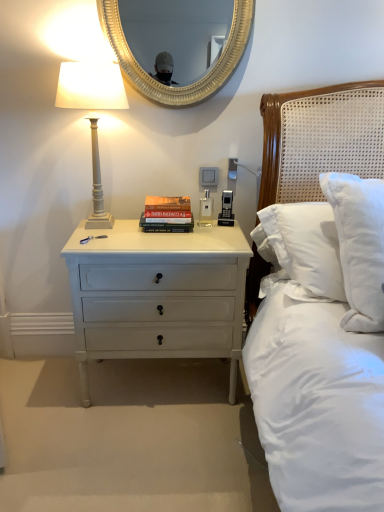
Question: Are gold textured mirror at upper center and white painted wood bedside lamp at left far apart?

Choices:
 (A) no
 (B) yes

Answer: (B)

Question: Would you say gold textured mirror at upper center contains white painted wood bedside lamp at left?

Choices:
 (A) yes
 (B) no

Answer: (B)

Question: Does gold textured mirror at upper center turn towards white painted wood bedside lamp at left?

Choices:
 (A) yes
 (B) no

Answer: (B)

Question: Is gold textured mirror at upper center behind white painted wood bedside lamp at left?

Choices:
 (A) no
 (B) yes

Answer: (B)

Question: From the image's perspective, would you say gold textured mirror at upper center is shown under white painted wood bedside lamp at left?

Choices:
 (A) yes
 (B) no

Answer: (B)

Question: Considering the relative sizes of gold textured mirror at upper center and white painted wood bedside lamp at left in the image provided, is gold textured mirror at upper center bigger than white painted wood bedside lamp at left?

Choices:
 (A) no
 (B) yes

Answer: (A)

Question: Does hardcover book at center have a greater height compared to gold textured mirror at upper center?

Choices:
 (A) yes
 (B) no

Answer: (B)

Question: Is hardcover book at center outside of gold textured mirror at upper center?

Choices:
 (A) no
 (B) yes

Answer: (B)

Question: Is hardcover book at center smaller than gold textured mirror at upper center?

Choices:
 (A) no
 (B) yes

Answer: (B)

Question: From a real-world perspective, does hardcover book at center stand above gold textured mirror at upper center?

Choices:
 (A) yes
 (B) no

Answer: (B)

Question: Can you confirm if hardcover book at center is wider than gold textured mirror at upper center?

Choices:
 (A) yes
 (B) no

Answer: (A)

Question: Is hardcover book at center directly adjacent to gold textured mirror at upper center?

Choices:
 (A) yes
 (B) no

Answer: (B)

Question: Can you confirm if white painted wood bedside lamp at left is wider than gold textured mirror at upper center?

Choices:
 (A) yes
 (B) no

Answer: (A)